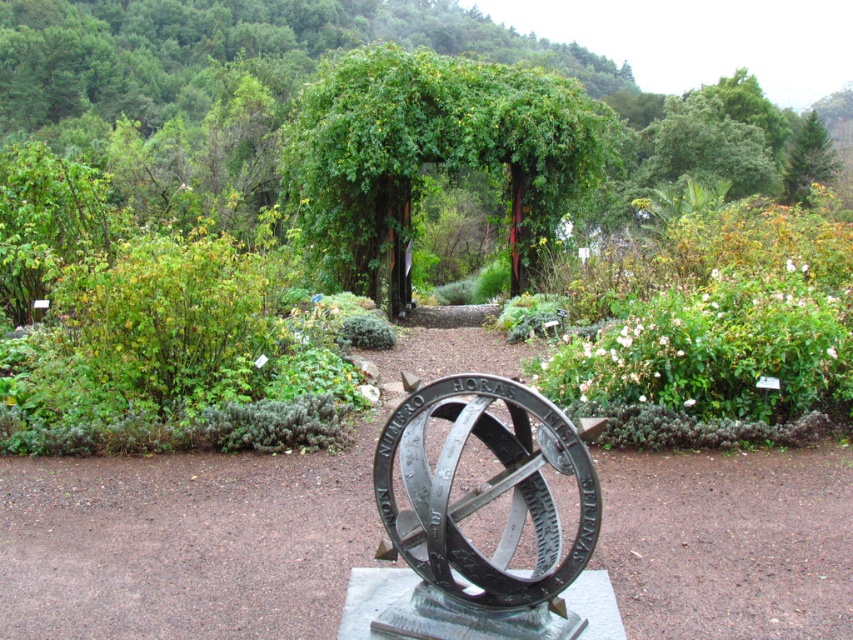
Question: Among these points, which one is nearest to the camera?

Choices:
 (A) (434, 467)
 (B) (109, 340)
 (C) (344, 100)

Answer: (A)

Question: Does green leafy tree at center appear over bronze sundial at center?

Choices:
 (A) no
 (B) yes

Answer: (B)

Question: Which object appears farthest from the camera in this image?

Choices:
 (A) green leafy bush at left
 (B) bronze sundial at center

Answer: (A)

Question: Which point is closer to the camera?

Choices:
 (A) (190, 260)
 (B) (509, 65)

Answer: (A)

Question: Does green leafy tree at center appear under bronze sundial at center?

Choices:
 (A) yes
 (B) no

Answer: (B)

Question: Is the position of bronze sundial at center more distant than that of green leafy bush at left?

Choices:
 (A) yes
 (B) no

Answer: (B)